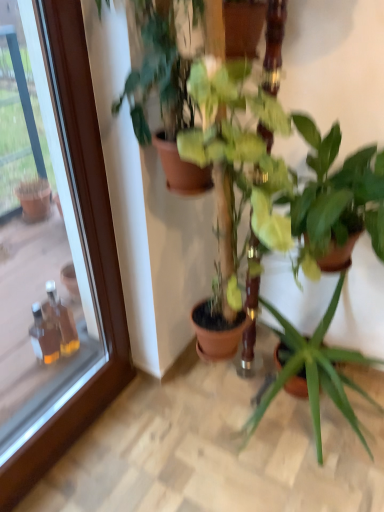
Question: Considering the positions of green matte plant at center, acting as the 4th houseplant starting from the left, and green matte plant at center, acting as the 4th houseplant starting from the right, in the image, is green matte plant at center, acting as the 4th houseplant starting from the left, wider or thinner than green matte plant at center, acting as the 4th houseplant starting from the right,?

Choices:
 (A) wide
 (B) thin

Answer: (A)

Question: From the image's perspective, is green matte plant at center, acting as the 4th houseplant starting from the left, located above or below green matte plant at center, acting as the 4th houseplant starting from the right?

Choices:
 (A) above
 (B) below

Answer: (B)

Question: Which is farther from the green matte plant at center, the 1th houseplant positioned from the right?

Choices:
 (A) green matte plant at center, which ranks as the 1th houseplant in left-to-right order
 (B) green glossy plant at center, which is counted as the third houseplant, starting from the left
 (C) green glossy plant at center, the 2th houseplant when ordered from left to right
 (D) transparent glass door at upper left

Answer: (A)

Question: Estimate the real-world distances between objects in this image. Which object is farther from the green matte plant at center, acting as the 4th houseplant starting from the right?

Choices:
 (A) green glossy plant at center, positioned as the second houseplant in right-to-left order
 (B) transparent glass door at upper left
 (C) green glossy plant at center, which appears as the 3th houseplant when viewed from the right
 (D) green matte plant at center, the 1th houseplant positioned from the right

Answer: (D)